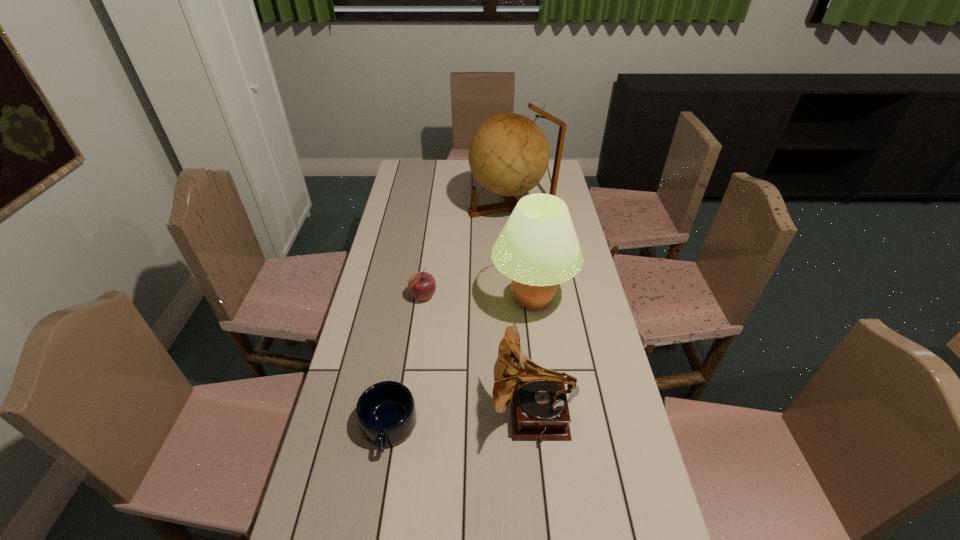
Locate an element on the screen. The height and width of the screenshot is (540, 960). globe situated at the right edge is located at coordinates (508, 154).

Where is `lampshade that is at the right edge`? Image resolution: width=960 pixels, height=540 pixels. lampshade that is at the right edge is located at coordinates (538, 248).

At what (x,y) coordinates should I click in order to perform the action: click on phonograph_record that is at the right edge. Please return your answer as a coordinate pair (x, y). The height and width of the screenshot is (540, 960). Looking at the image, I should click on (539, 408).

Locate an element on the screen. The width and height of the screenshot is (960, 540). object located at the far right corner is located at coordinates (508, 154).

This screenshot has height=540, width=960. I want to click on vacant area at the left edge, so click(416, 248).

This screenshot has height=540, width=960. I want to click on blank area at the right edge, so click(x=617, y=501).

I want to click on blank space at the far left corner, so click(x=420, y=167).

Identify the location of free space that is in between the phonograph_record and the apple. Image resolution: width=960 pixels, height=540 pixels. (478, 355).

I want to click on empty space that is in between the globe and the fourth tallest object, so click(x=468, y=252).

Point out which object is positioned as the second nearest to the shortest object. Please provide its 2D coordinates. Your answer should be formatted as a tuple, i.e. [(x, y)], where the tuple contains the x and y coordinates of a point satisfying the conditions above.

[(538, 248)]